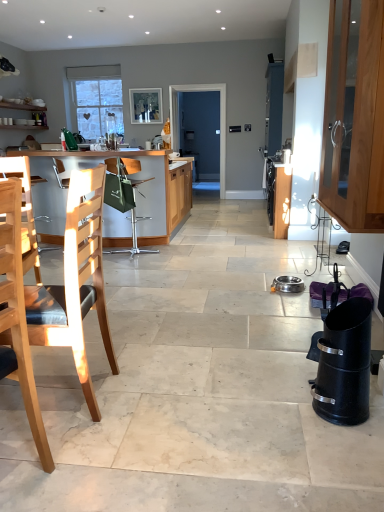
Measure the distance between point (339, 309) and camera.

Point (339, 309) is 6.41 feet away from camera.

I want to click on black matte trash can at lower right, the second appliance from the back, so click(344, 364).

At what (x,y) coordinates should I click in order to perform the action: click on metallic silver bowl at center, which is counted as the 1th appliance, starting from the back. Please return your answer as a coordinate pair (x, y). This screenshot has width=384, height=512. Looking at the image, I should click on (287, 284).

Describe the element at coordinates (200, 131) in the screenshot. Image resolution: width=384 pixels, height=512 pixels. I see `blue matte screen door at center` at that location.

Where is `light wood chair at left, the 3th chair positioned from the back`? light wood chair at left, the 3th chair positioned from the back is located at coordinates (x=18, y=316).

From the image's perspective, which one is positioned higher, wooden cabinet at right or wooden table at left?

From the image's view, wooden cabinet at right is above.

Does wooden cabinet at right come in front of wooden table at left?

Yes, it is in front of wooden table at left.

What's the angular difference between wooden cabinet at right and wooden table at left's facing directions?

The angular difference between wooden cabinet at right and wooden table at left is 90.2 degrees.

Is light wood chair at left, the 3th chair positioned from the back, with green fabric chair at center, which appears as the third chair when viewed from the front?

light wood chair at left, the 3th chair positioned from the back, and green fabric chair at center, which appears as the third chair when viewed from the front, are clearly separated.

Is light wood chair at left, the 3th chair positioned from the back, situated inside green fabric chair at center, the first chair from the back, or outside?

light wood chair at left, the 3th chair positioned from the back, is not inside green fabric chair at center, the first chair from the back, it's outside.

Measure the distance between light wood chair at left, marked as the first chair in a front-to-back arrangement, and green fabric chair at center, the first chair from the back.

A distance of 3.12 meters exists between light wood chair at left, marked as the first chair in a front-to-back arrangement, and green fabric chair at center, the first chair from the back.

At what (x,y) coordinates should I click in order to perform the action: click on cabinetry above the light wood chair at left, marked as the first chair in a front-to-back arrangement (from a real-world perspective). Please return your answer as a coordinate pair (x, y). Looking at the image, I should click on (354, 116).

From a real-world perspective, is light wood chair at left, the 3th chair positioned from the back, above or below wooden cabinet at right?

From a real-world perspective, light wood chair at left, the 3th chair positioned from the back, is physically below wooden cabinet at right.

Measure the distance from light wood chair at left, marked as the first chair in a front-to-back arrangement, to wooden cabinet at right.

The distance of light wood chair at left, marked as the first chair in a front-to-back arrangement, from wooden cabinet at right is 6.76 feet.

Which is in front, point (29, 408) or point (339, 134)?

Point (29, 408)

Considering the relative positions of metallic silver bowl at center, arranged as the 2th appliance when viewed from the front, and matte wooden picture frame at upper center in the image provided, is metallic silver bowl at center, arranged as the 2th appliance when viewed from the front, to the left or to the right of matte wooden picture frame at upper center?

From the image, it's evident that metallic silver bowl at center, arranged as the 2th appliance when viewed from the front, is to the right of matte wooden picture frame at upper center.

Consider the image. Considering the sizes of objects metallic silver bowl at center, which is counted as the 1th appliance, starting from the back, and matte wooden picture frame at upper center in the image provided, who is thinner, metallic silver bowl at center, which is counted as the 1th appliance, starting from the back, or matte wooden picture frame at upper center?

matte wooden picture frame at upper center is thinner.

Is metallic silver bowl at center, arranged as the 2th appliance when viewed from the front, not inside matte wooden picture frame at upper center?

That's correct, metallic silver bowl at center, arranged as the 2th appliance when viewed from the front, is outside of matte wooden picture frame at upper center.

From a real-world perspective, is metallic silver bowl at center, which is counted as the 1th appliance, starting from the back, physically located above or below matte wooden picture frame at upper center?

In terms of real-world spatial position, metallic silver bowl at center, which is counted as the 1th appliance, starting from the back, is below matte wooden picture frame at upper center.

Is green fabric chair at center, which appears as the third chair when viewed from the front, further to camera compared to matte wooden picture frame at upper center?

No, it is in front of matte wooden picture frame at upper center.

Can you confirm if green fabric chair at center, which appears as the third chair when viewed from the front, is positioned to the left of matte wooden picture frame at upper center?

No, green fabric chair at center, which appears as the third chair when viewed from the front, is not to the left of matte wooden picture frame at upper center.

Based on their sizes in the image, would you say green fabric chair at center, the first chair from the back, is bigger or smaller than matte wooden picture frame at upper center?

green fabric chair at center, the first chair from the back, is bigger than matte wooden picture frame at upper center.

Considering the positions of objects metallic silver bowl at center, which is counted as the 1th appliance, starting from the back, and light wood chair at left, which is counted as the 2th chair, starting from the front, in the image provided, who is more to the right, metallic silver bowl at center, which is counted as the 1th appliance, starting from the back, or light wood chair at left, which is counted as the 2th chair, starting from the front,?

From the viewer's perspective, metallic silver bowl at center, which is counted as the 1th appliance, starting from the back, appears more on the right side.

Is metallic silver bowl at center, which is counted as the 1th appliance, starting from the back, taller than light wood chair at left, the second chair viewed from the back?

No.

From a real-world perspective, is metallic silver bowl at center, which is counted as the 1th appliance, starting from the back, physically above light wood chair at left, which is counted as the 2th chair, starting from the front?

No, from a real-world perspective, metallic silver bowl at center, which is counted as the 1th appliance, starting from the back, is not above light wood chair at left, which is counted as the 2th chair, starting from the front.

From the image's perspective, which one is positioned lower, matte wooden picture frame at upper center or blue matte screen door at center?

blue matte screen door at center appears lower in the image.

You are a GUI agent. You are given a task and a screenshot of the screen. Output one action in this format:
    pyautogui.click(x=<x>, y=<y>)
    Task: Click on the screen door beneath the matte wooden picture frame at upper center (from a real-world perspective)
    This screenshot has width=384, height=512.
    Given the screenshot: What is the action you would take?
    tap(200, 131)

Who is shorter, matte wooden picture frame at upper center or blue matte screen door at center?

matte wooden picture frame at upper center is shorter.

How distant is matte wooden picture frame at upper center from blue matte screen door at center?

matte wooden picture frame at upper center is 86.40 centimeters from blue matte screen door at center.

Find the location of a particular element. The height and width of the screenshot is (512, 384). cabinetry on the right of wooden table at left is located at coordinates (354, 116).

Identify the location of the 2nd chair counting from the left side of the green fabric chair at center, which appears as the third chair when viewed from the front. This screenshot has width=384, height=512. (18, 316).

Considering their positions, is wooden cabinet at right positioned closer to light wood chair at left, the second chair viewed from the back, than metallic silver bowl at center, which is counted as the 1th appliance, starting from the back?

The object closer to light wood chair at left, the second chair viewed from the back, is wooden cabinet at right.

Which object lies further to the anchor point black matte trash can at lower right, which is the first appliance from front to back, wooden table at left or light wood chair at left, which is counted as the 2th chair, starting from the front?

Based on the image, wooden table at left appears to be further to black matte trash can at lower right, which is the first appliance from front to back.

When comparing their distances from blue matte screen door at center, does light wood chair at left, the second chair viewed from the back, or wooden cabinet at right seem further?

The object further to blue matte screen door at center is light wood chair at left, the second chair viewed from the back.

From the image, which object appears to be nearer to light wood chair at left, marked as the first chair in a front-to-back arrangement, black matte trash can at lower right, which is the first appliance from front to back, or wooden table at left?

Among the two, black matte trash can at lower right, which is the first appliance from front to back, is located nearer to light wood chair at left, marked as the first chair in a front-to-back arrangement.

Which object lies nearer to the anchor point green fabric chair at center, the first chair from the back, blue matte screen door at center or light wood chair at left, the second chair viewed from the back?

The object closer to green fabric chair at center, the first chair from the back, is light wood chair at left, the second chair viewed from the back.

When comparing their distances from green fabric chair at center, the first chair from the back, does matte wooden picture frame at upper center or black matte trash can at lower right, the second appliance from the back, seem further?

Based on the image, black matte trash can at lower right, the second appliance from the back, appears to be further to green fabric chair at center, the first chair from the back.

Based on their spatial positions, is matte wooden picture frame at upper center or green fabric chair at center, the first chair from the back, further from black matte trash can at lower right, which is the first appliance from front to back?

The object further to black matte trash can at lower right, which is the first appliance from front to back, is matte wooden picture frame at upper center.

Which object lies nearer to the anchor point light wood chair at left, marked as the first chair in a front-to-back arrangement, green fabric chair at center, the first chair from the back, or matte wooden picture frame at upper center?

green fabric chair at center, the first chair from the back, is closer to light wood chair at left, marked as the first chair in a front-to-back arrangement.

You are a GUI agent. You are given a task and a screenshot of the screen. Output one action in this format:
    pyautogui.click(x=<x>, y=<y>)
    Task: Click on the chair between light wood chair at left, the second chair viewed from the back, and blue matte screen door at center in the front-back direction
    This screenshot has width=384, height=512.
    Given the screenshot: What is the action you would take?
    pyautogui.click(x=133, y=239)

This screenshot has width=384, height=512. Find the location of `appliance between wooden cabinet at right and blue matte screen door at center in the front-back direction`. appliance between wooden cabinet at right and blue matte screen door at center in the front-back direction is located at coordinates (287, 284).

Find the location of a particular element. The width and height of the screenshot is (384, 512). cabinetry located between light wood chair at left, the 3th chair positioned from the back, and blue matte screen door at center in the depth direction is located at coordinates (354, 116).

Where is `screen door between wooden table at left and matte wooden picture frame at upper center in the front-back direction`? The height and width of the screenshot is (512, 384). screen door between wooden table at left and matte wooden picture frame at upper center in the front-back direction is located at coordinates (200, 131).